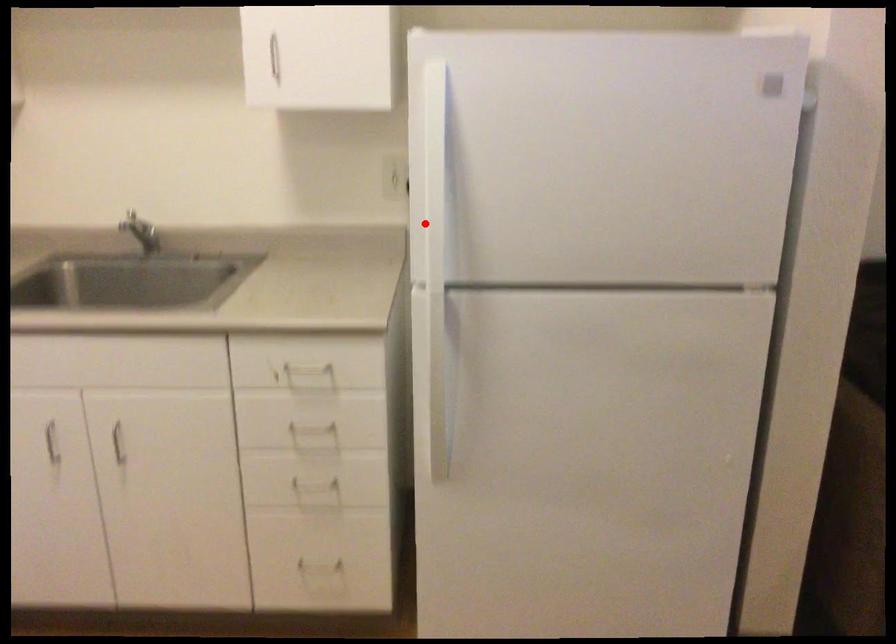
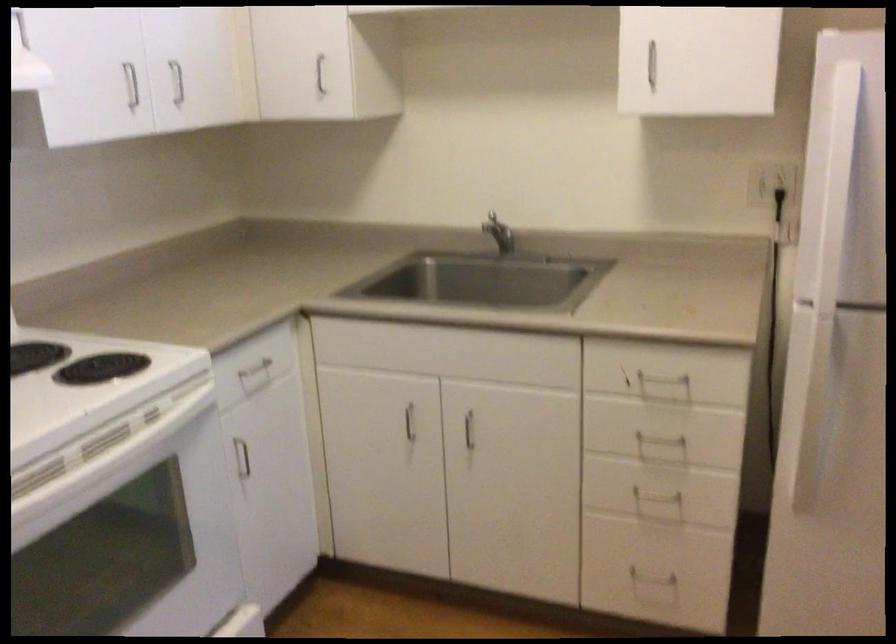
The point at the highlighted location is marked in the first image. Where is the corresponding point in the second image?

(831, 240)